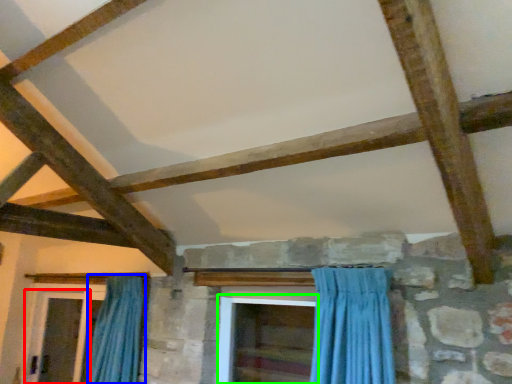
Question: Which object is positioned farthest from screen door (highlighted by a red box)? Select from curtain (highlighted by a blue box) and screen door (highlighted by a green box).

Choices:
 (A) curtain
 (B) screen door

Answer: (B)